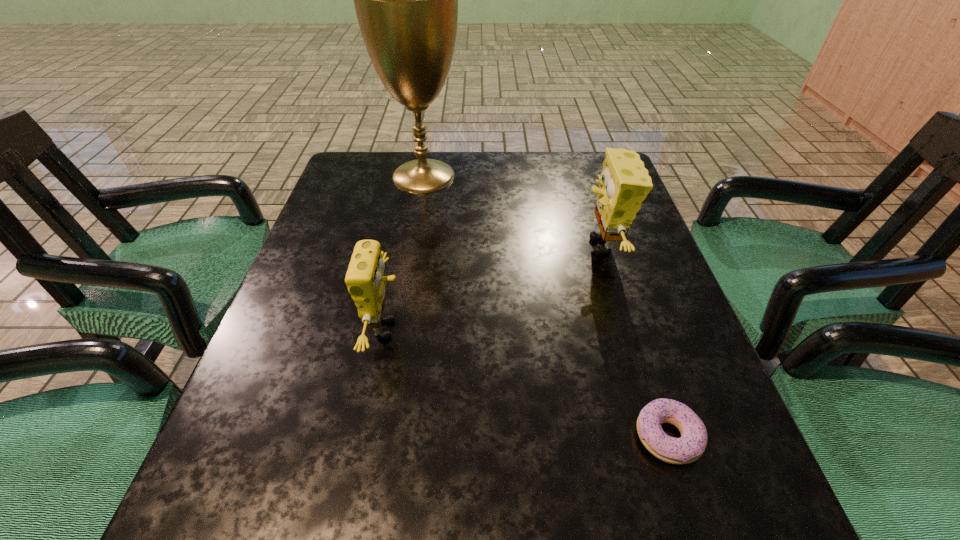
Identify the location of trophy cup. (406, 0).

Find the location of a particular element. Image resolution: width=960 pixels, height=540 pixels. the farthest object is located at coordinates 406,0.

Locate an element on the screen. Image resolution: width=960 pixels, height=540 pixels. the right sponge is located at coordinates (624, 183).

Identify the location of the second shortest object. pyautogui.click(x=365, y=280).

This screenshot has width=960, height=540. What are the coordinates of `the left sponge` in the screenshot? It's located at tap(365, 280).

Locate an element on the screen. The height and width of the screenshot is (540, 960). doughnut is located at coordinates (693, 442).

Find the location of `the nearest object`. the nearest object is located at coordinates (693, 442).

Find the location of `free space located 0.050m on the right of the farthest object`. free space located 0.050m on the right of the farthest object is located at coordinates (482, 176).

I want to click on vacant space located 0.130m on the face of the right sponge, so click(x=523, y=246).

Where is `vacant region located 0.150m on the face of the right sponge`? The height and width of the screenshot is (540, 960). vacant region located 0.150m on the face of the right sponge is located at coordinates (515, 246).